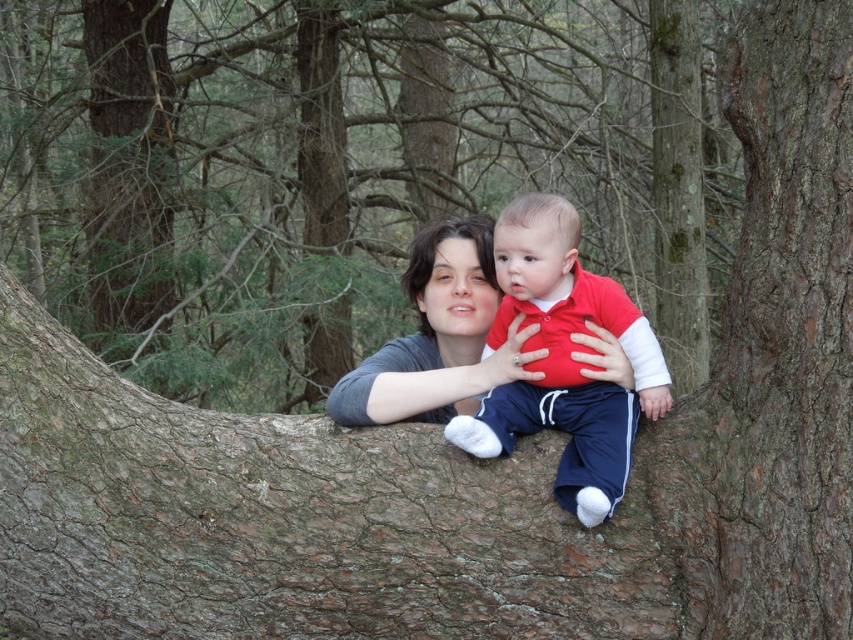
Between matte red shirt at center and matte gray sweater at center, which one is positioned higher?

matte gray sweater at center is higher up.

You are a GUI agent. You are given a task and a screenshot of the screen. Output one action in this format:
    pyautogui.click(x=<x>, y=<y>)
    Task: Click on the matte red shirt at center
    
    Given the screenshot: What is the action you would take?
    pyautogui.click(x=564, y=358)